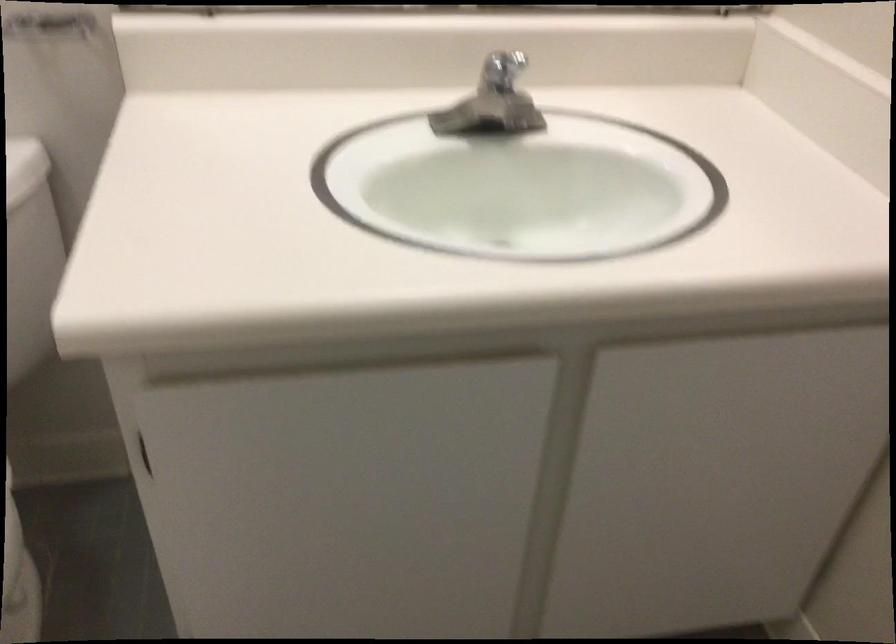
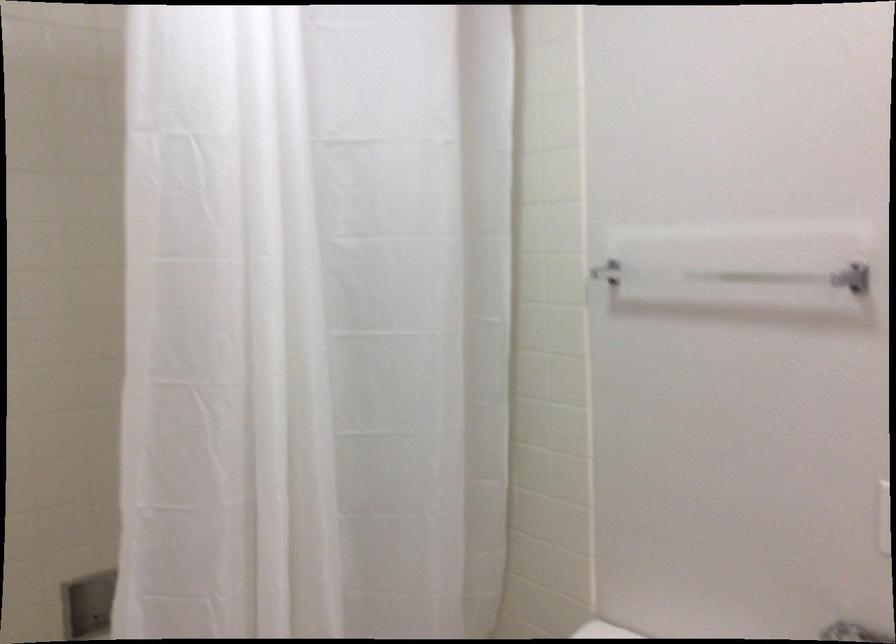
Question: The images are taken continuously from a first-person perspective. In which direction is your viewpoint rotating?

Choices:
 (A) Left
 (B) Right
 (C) Up
 (D) Down

Answer: (A)